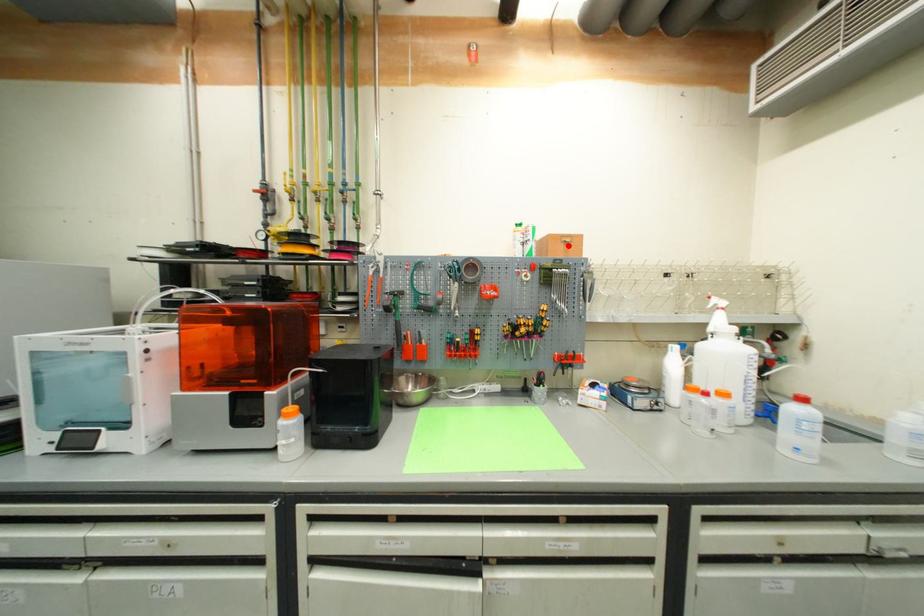
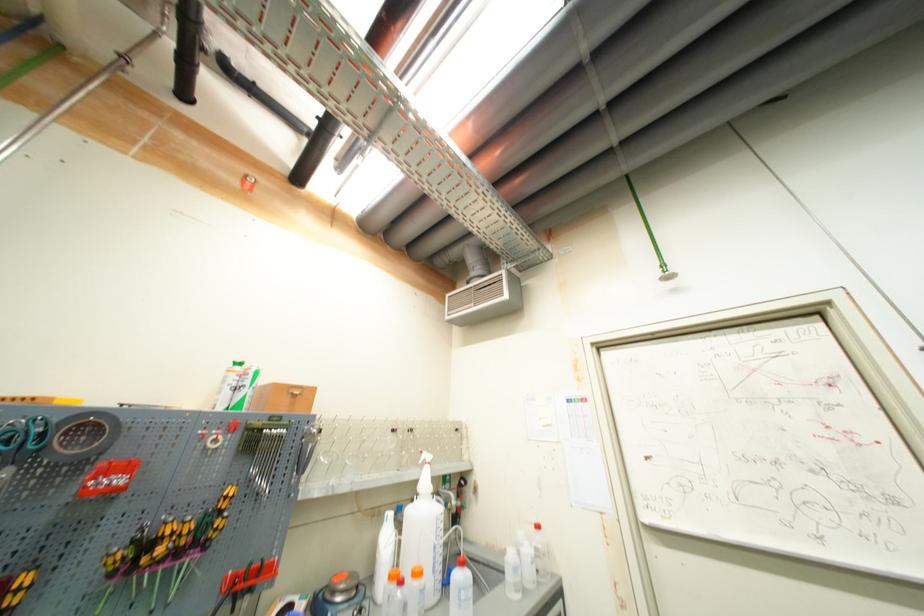
The point at the highlighted location is marked in the first image. Where is the corresponding point in the second image?

(295, 398)